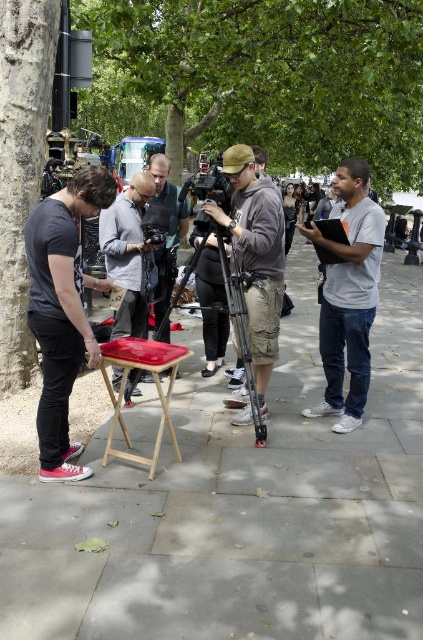
Question: Is gray cotton shirt at right positioned in front of matte black camera at center?

Choices:
 (A) yes
 (B) no

Answer: (A)

Question: Which point is farther to the camera?

Choices:
 (A) (5, 280)
 (B) (411, 598)
 (C) (158, 452)

Answer: (A)

Question: Is green leafy tree at upper center positioned behind matte black camera at center?

Choices:
 (A) yes
 (B) no

Answer: (A)

Question: Which object appears farthest from the camera in this image?

Choices:
 (A) green leafy tree at upper center
 (B) red glossy stool at lower center

Answer: (A)

Question: Observing the image, what is the correct spatial positioning of smooth bark tree at left in reference to gray cotton shirt at right?

Choices:
 (A) left
 (B) right

Answer: (A)

Question: Among these points, which one is farthest from the camera?

Choices:
 (A) (118, 253)
 (B) (419, 410)
 (C) (79, 209)
 (D) (247, 387)

Answer: (B)